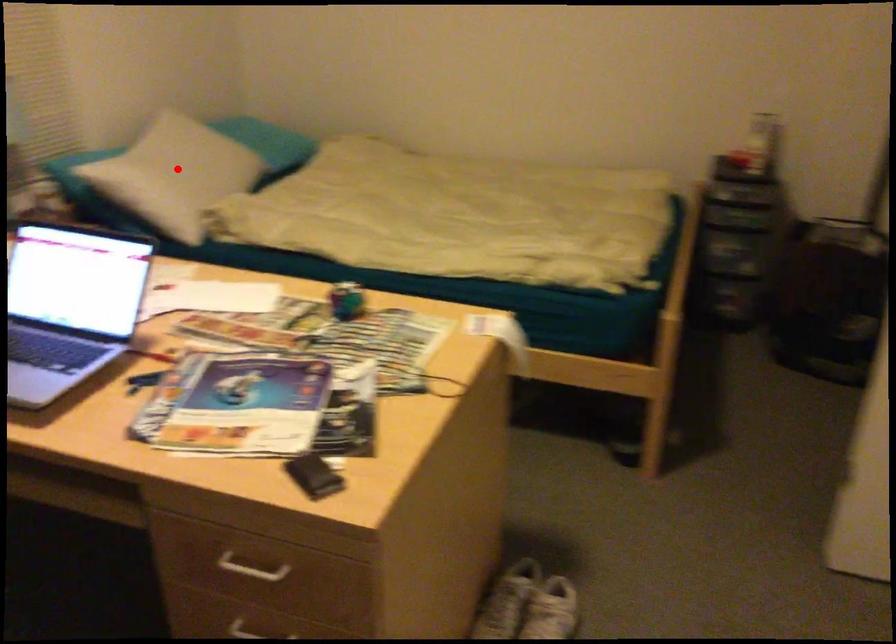
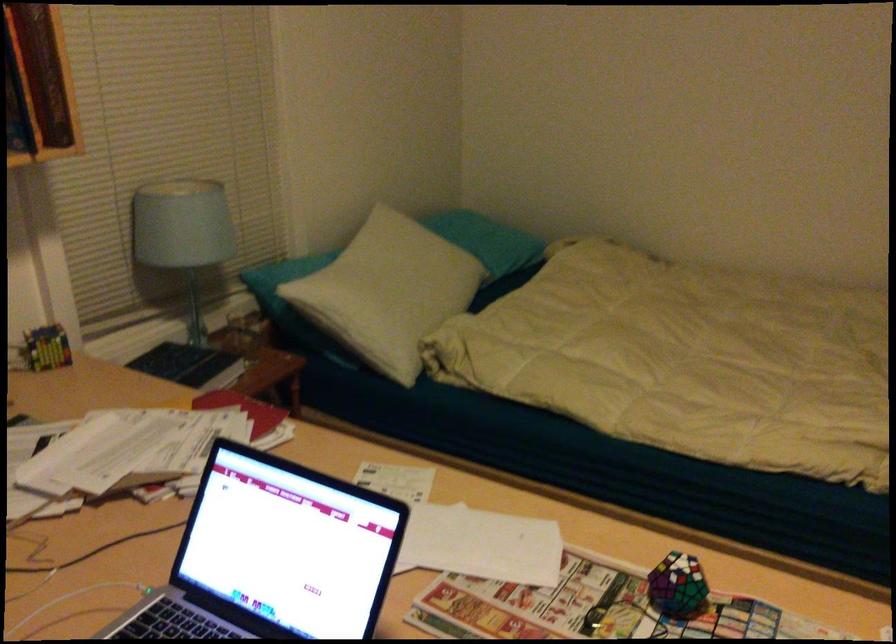
Find the pixel in the second image that matches the highlighted location in the first image.

(391, 285)